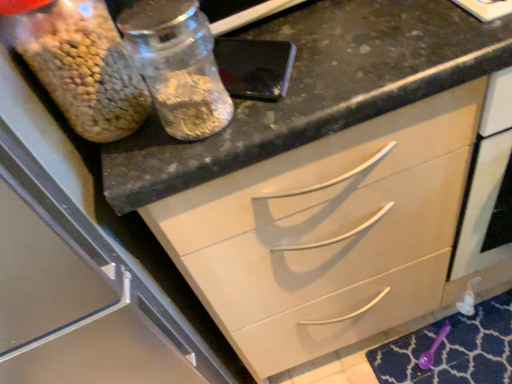
The height and width of the screenshot is (384, 512). Find the location of `free space in front of translucent glass jar at upper left`. free space in front of translucent glass jar at upper left is located at coordinates (146, 156).